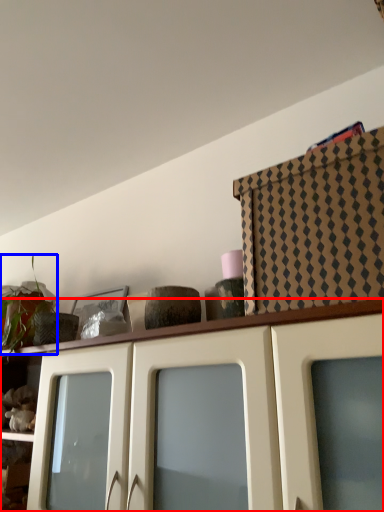
Question: Among these objects, which one is nearest to the camera, cabinetry (highlighted by a red box) or plant (highlighted by a blue box)?

Choices:
 (A) cabinetry
 (B) plant

Answer: (A)